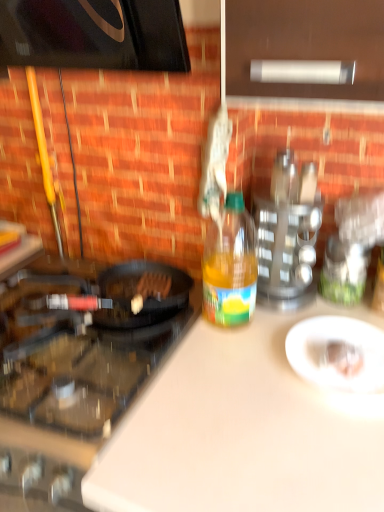
Question: In terms of size, does yellow translucent bottle at center appear bigger or smaller than black glass gas stove at left?

Choices:
 (A) big
 (B) small

Answer: (B)

Question: From the image's perspective, relative to black glass gas stove at left, is yellow translucent bottle at center above or below?

Choices:
 (A) below
 (B) above

Answer: (B)

Question: Based on their relative distances, which object is farther from the white glossy plate at center?

Choices:
 (A) black glass gas stove at left
 (B) metallic silver spice rack at upper right
 (C) white matte cutting board at center
 (D) yellow translucent bottle at center

Answer: (A)

Question: Which object is the closest to the white glossy plate at center?

Choices:
 (A) white matte cutting board at center
 (B) yellow translucent bottle at center
 (C) black glass gas stove at left
 (D) metallic silver spice rack at upper right

Answer: (A)